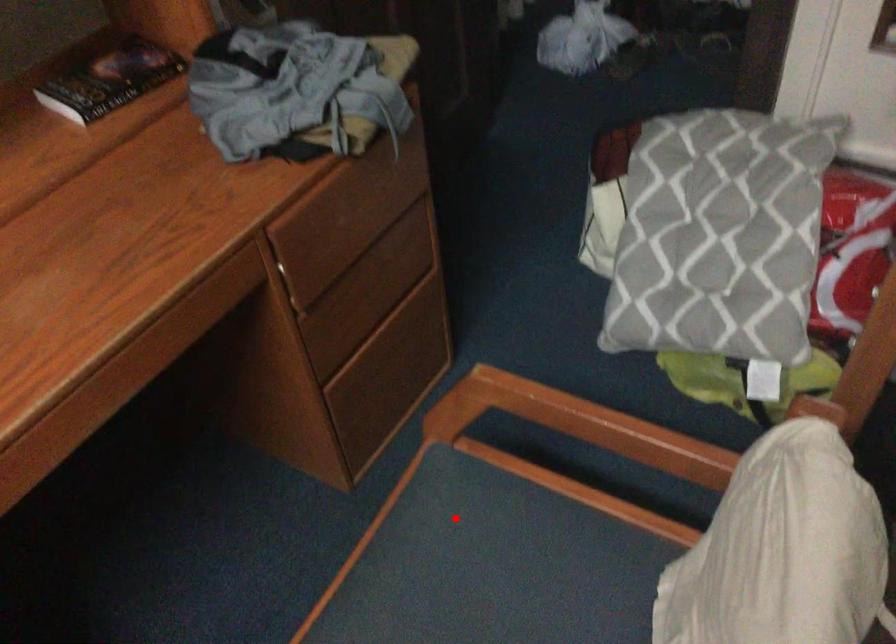
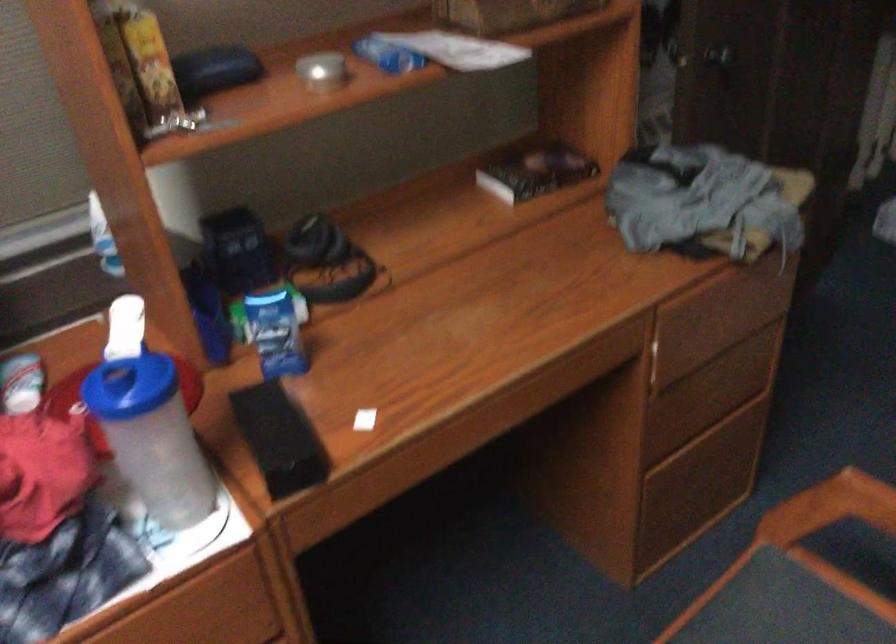
Where in the second image is the point corresponding to the highlighted location from the first image?

(780, 614)